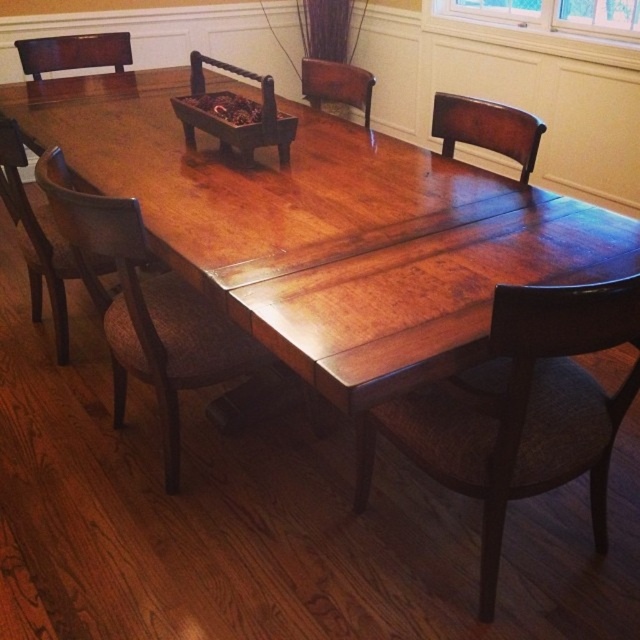
You are arranging a dinner party and want to place a centerpiece on the wooden tray at center. Considering the clear glass window at upper center, which object is more suitable for holding decorations?

The wooden tray at center is more suitable for holding decorations because it is thicker than the clear glass window at upper center, making it a stable surface for placement.

From the picture: You are sitting in the brown woven armchair at left and want to reach the wooden tray at center. Can you easily grab an item from the tray without moving your chair?

The brown woven armchair at left is closer to the viewer than the wooden tray at center, so you would need to lean forward or move your chair to reach the tray.

You are standing in the dining room and want to sit in the dark brown wood armchair at upper left. Based on its 2D coordinates, which corner of the table should you approach to reach the chair?

The dark brown wood armchair at upper left is located at coordinates point (74, 52), so you should approach the upper left corner of the table to reach the chair.